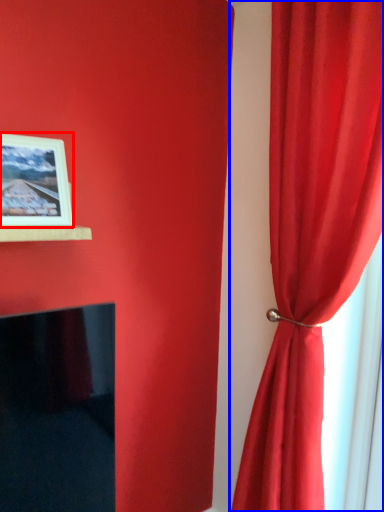
Question: Which object is closer to the camera taking this photo, picture frame (highlighted by a red box) or curtain (highlighted by a blue box)?

Choices:
 (A) picture frame
 (B) curtain

Answer: (B)